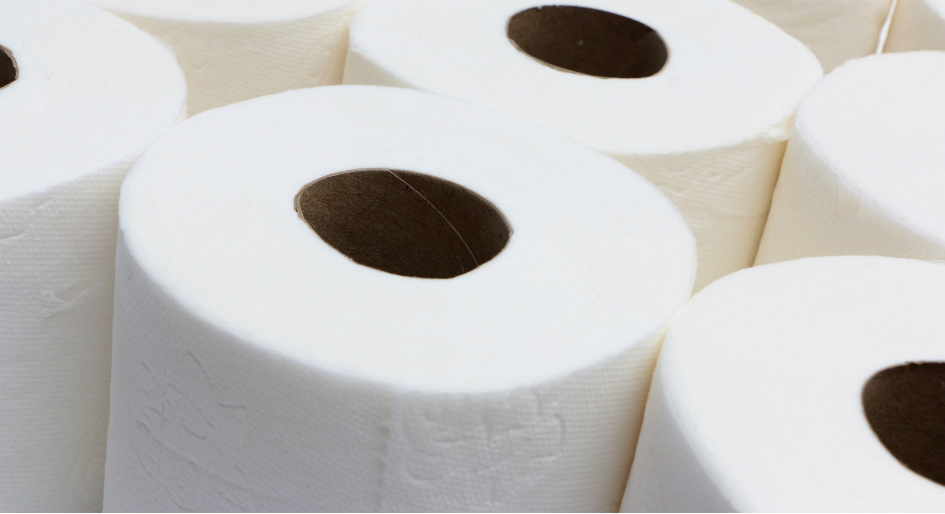
Locate an element on the screen. The width and height of the screenshot is (945, 514). toilet paper is located at coordinates (76, 89), (236, 38), (384, 41), (821, 131), (777, 351), (576, 270).